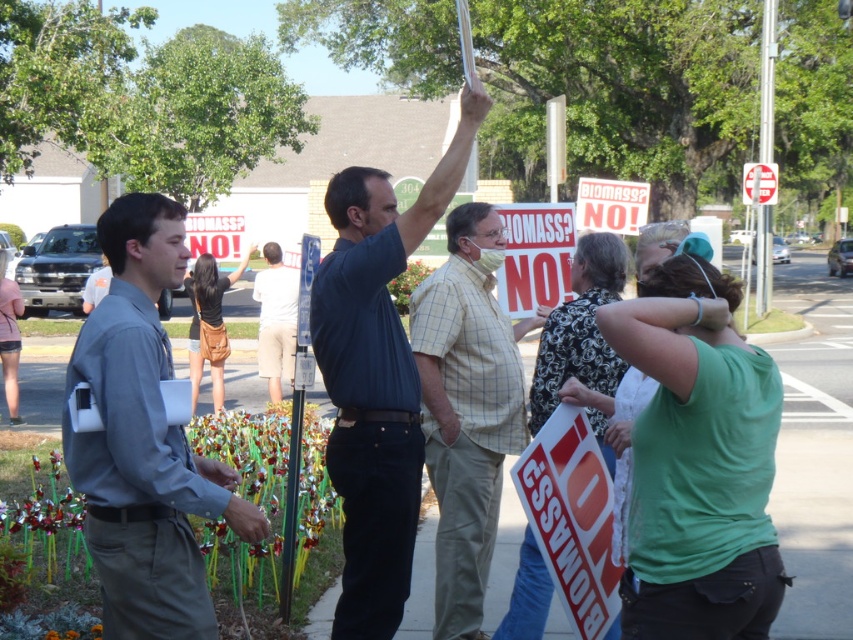
Question: Is dark blue shirt at center to the right of light brown plaid shirt at center from the viewer's perspective?

Choices:
 (A) yes
 (B) no

Answer: (B)

Question: Which of the following is the closest to the observer?

Choices:
 (A) (340, 324)
 (B) (152, 461)
 (C) (425, 282)
 (D) (297, 269)

Answer: (B)

Question: Which of the following is the closest to the observer?

Choices:
 (A) white cotton shorts at center
 (B) gray shirt at left
 (C) dark blue shirt at center

Answer: (B)

Question: Can you confirm if light brown plaid shirt at center is bigger than white cotton shorts at center?

Choices:
 (A) no
 (B) yes

Answer: (A)

Question: Which of the following is the closest to the observer?

Choices:
 (A) (456, 161)
 (B) (144, 362)
 (C) (527, 323)
 (D) (264, 371)

Answer: (B)

Question: Does gray shirt at left have a smaller size compared to light brown plaid shirt at center?

Choices:
 (A) no
 (B) yes

Answer: (B)